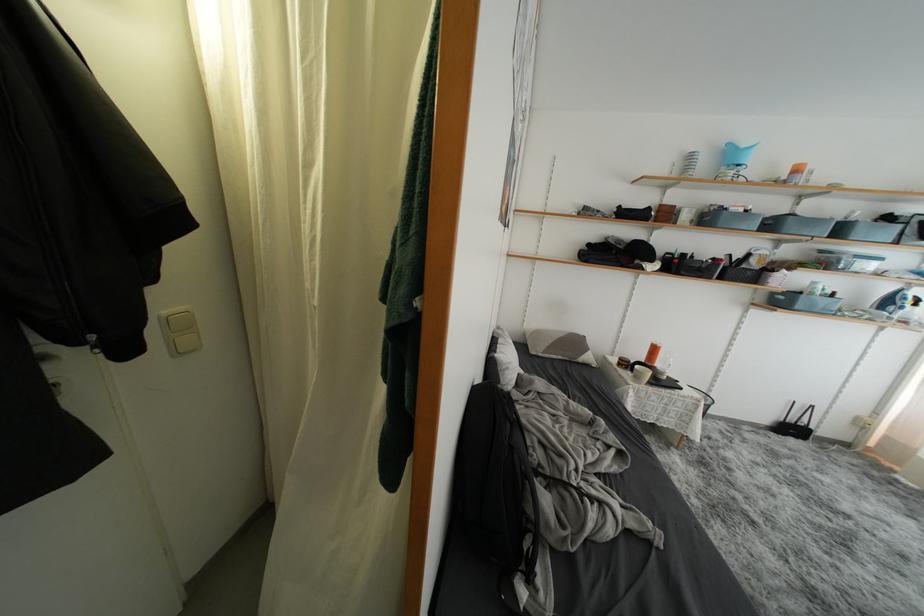
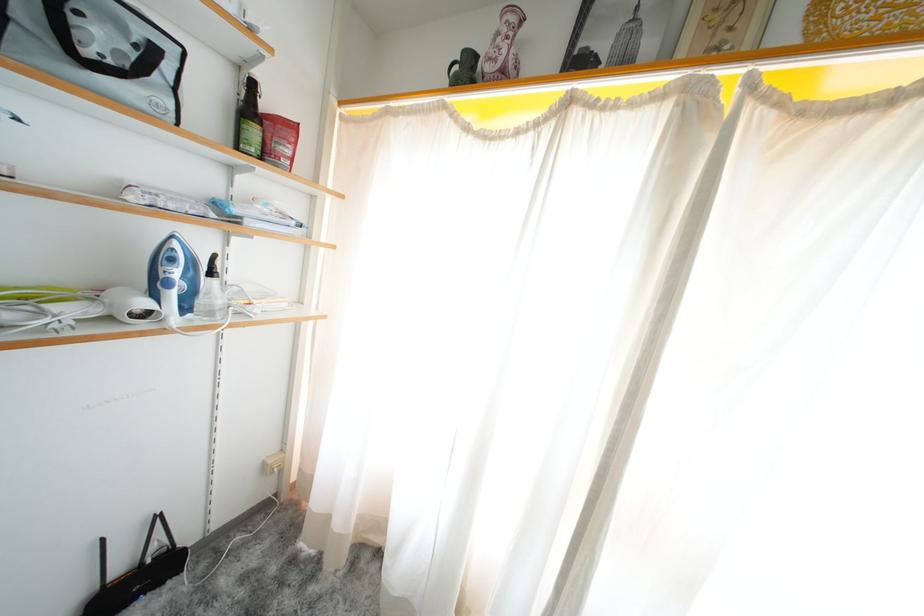
Where in the second image is the point corresponding to (797,434) from the first image?

(143, 586)